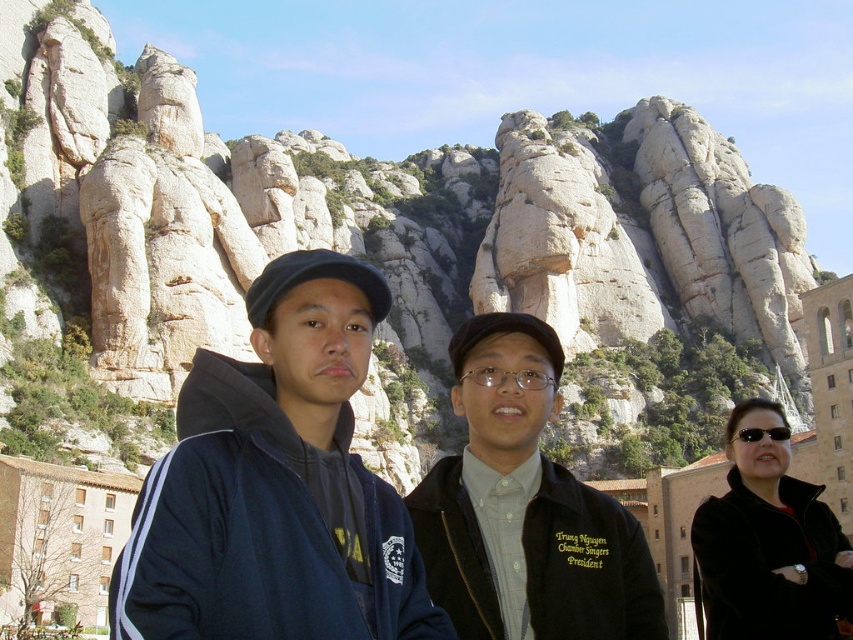
This screenshot has width=853, height=640. What do you see at coordinates (279, 486) in the screenshot?
I see `dark blue jacket at center` at bounding box center [279, 486].

Which is behind, point (233, 488) or point (766, 454)?

The point (766, 454) is more distant.

Is point (558, 586) more distant than point (792, 497)?

No, (558, 586) is closer to viewer.

At what (x,y) coordinates should I click in order to perform the action: click on dark blue jacket at center. Please return your answer as a coordinate pair (x, y). This screenshot has height=640, width=853. Looking at the image, I should click on (279, 486).

Is dark blue jacket at center shorter than black plastic sunglasses at center?

No.

What do you see at coordinates (279, 486) in the screenshot? The height and width of the screenshot is (640, 853). I see `dark blue jacket at center` at bounding box center [279, 486].

The width and height of the screenshot is (853, 640). I want to click on dark blue jacket at center, so click(x=279, y=486).

Is point (828, 524) farther from camera compared to point (737, 436)?

That is False.

Between point (833, 611) and point (758, 440), which one is positioned behind?

The point (758, 440) is behind.

Who is more forward, (723, 593) or (775, 428)?

Point (723, 593) is more forward.

I want to click on black leather jacket at lower right, so click(769, 545).